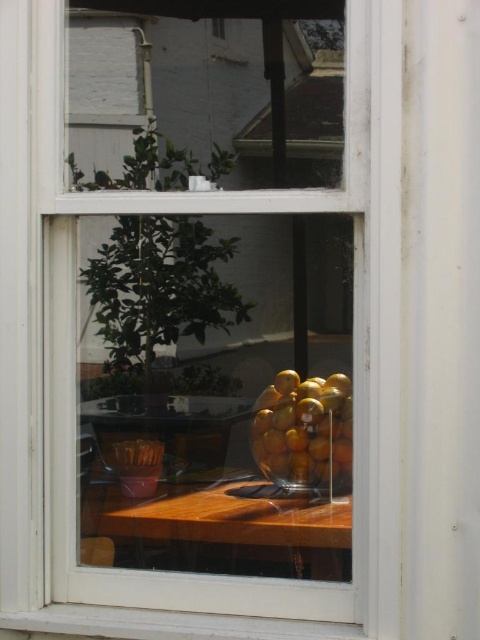
Can you confirm if wooden table at center is smaller than shiny golden fruit at center?

Actually, wooden table at center might be larger than shiny golden fruit at center.

Is wooden table at center bigger than shiny golden fruit at center?

Correct, wooden table at center is larger in size than shiny golden fruit at center.

The height and width of the screenshot is (640, 480). What do you see at coordinates (228, 529) in the screenshot?
I see `wooden table at center` at bounding box center [228, 529].

Find the location of `wooden table at center`. wooden table at center is located at coordinates (228, 529).